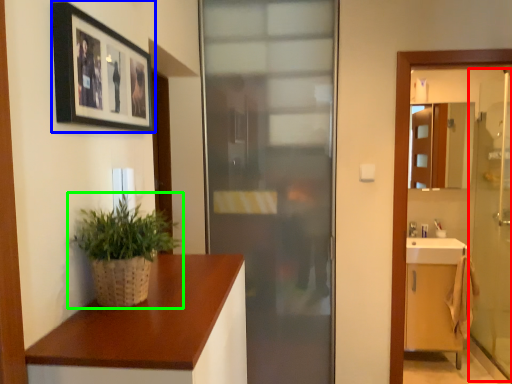
Question: Which object is positioned closest to screen door (highlighted by a red box)? Select from picture frame (highlighted by a blue box) and houseplant (highlighted by a green box).

Choices:
 (A) picture frame
 (B) houseplant

Answer: (A)